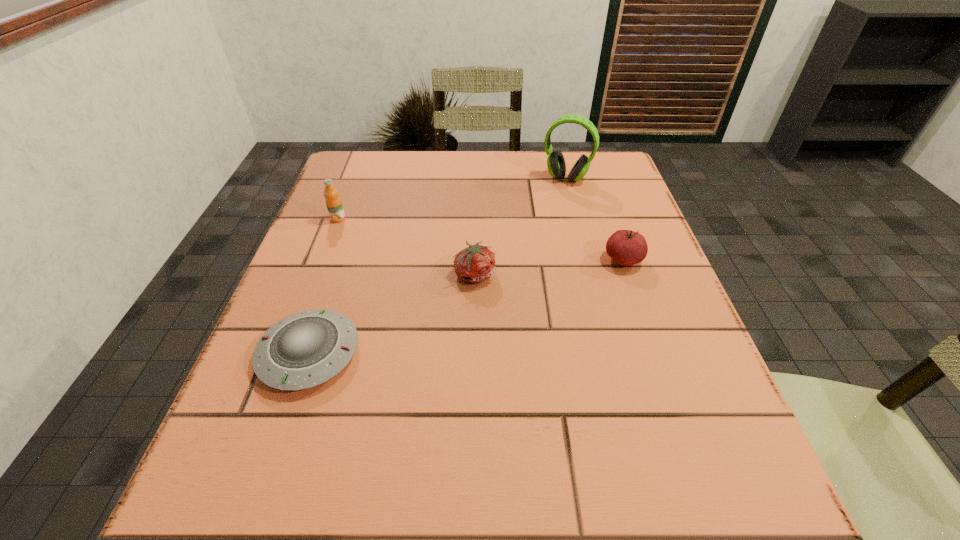
This screenshot has height=540, width=960. Identify the location of the tallest object. (556, 165).

The image size is (960, 540). In order to click on headset in this screenshot , I will do `click(556, 165)`.

Where is `the second farthest object`? the second farthest object is located at coordinates (333, 202).

At what (x,y) coordinates should I click in order to perform the action: click on orange juice. Please return your answer as a coordinate pair (x, y). Looking at the image, I should click on pyautogui.click(x=333, y=202).

Find the location of a particular element. The height and width of the screenshot is (540, 960). the right tomato is located at coordinates (626, 247).

Find the location of `the third object from left to right`. the third object from left to right is located at coordinates (476, 263).

Image resolution: width=960 pixels, height=540 pixels. I want to click on the shortest object, so click(x=308, y=348).

Locate an element on the screen. saucer is located at coordinates (308, 348).

Where is `blank area located on the left of the tallest object`? blank area located on the left of the tallest object is located at coordinates (405, 178).

Locate an element on the screen. This screenshot has width=960, height=540. free location located on the label of the orange juice is located at coordinates (307, 299).